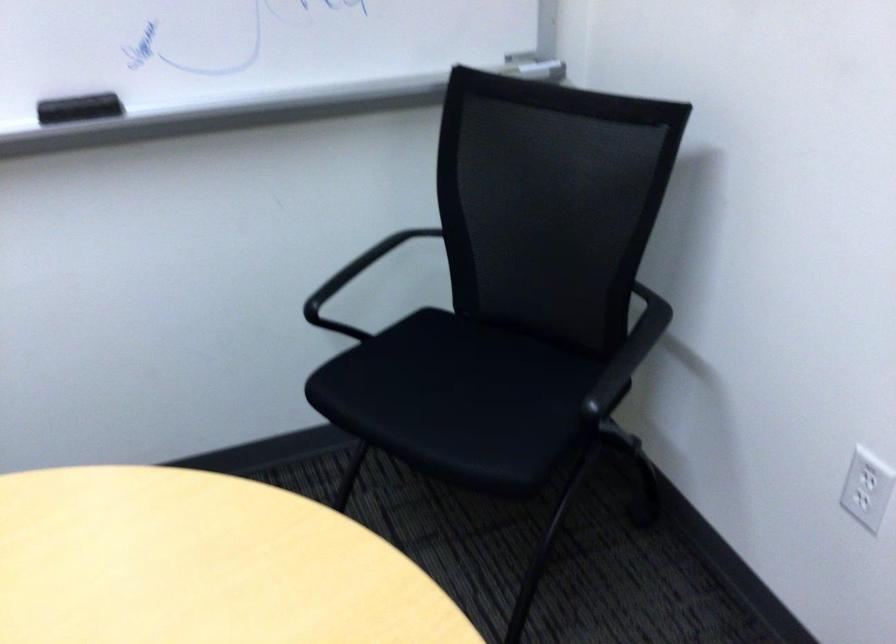
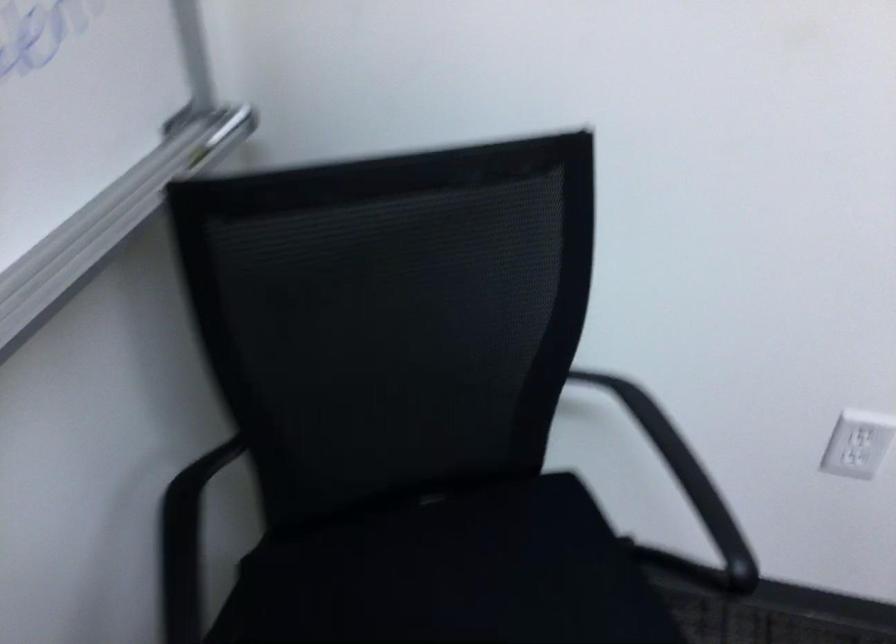
First-person continuous shooting, in which direction is the camera rotating?

The camera's rotation is toward right-down.